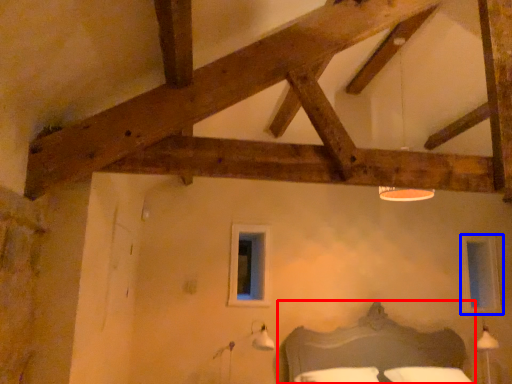
Question: Among these objects, which one is nearest to the camera, bed (highlighted by a red box) or window (highlighted by a blue box)?

Choices:
 (A) bed
 (B) window

Answer: (A)